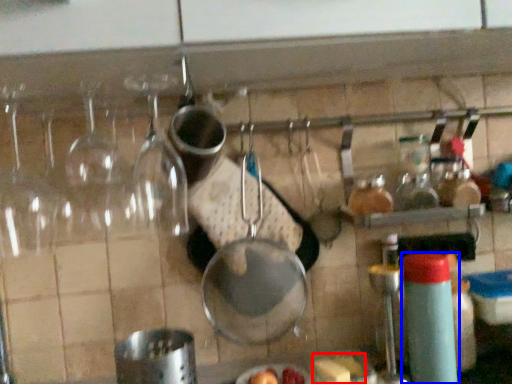
Question: Which of the following is the closest to the observer, food (highlighted by a red box) or bottle (highlighted by a blue box)?

Choices:
 (A) food
 (B) bottle

Answer: (B)